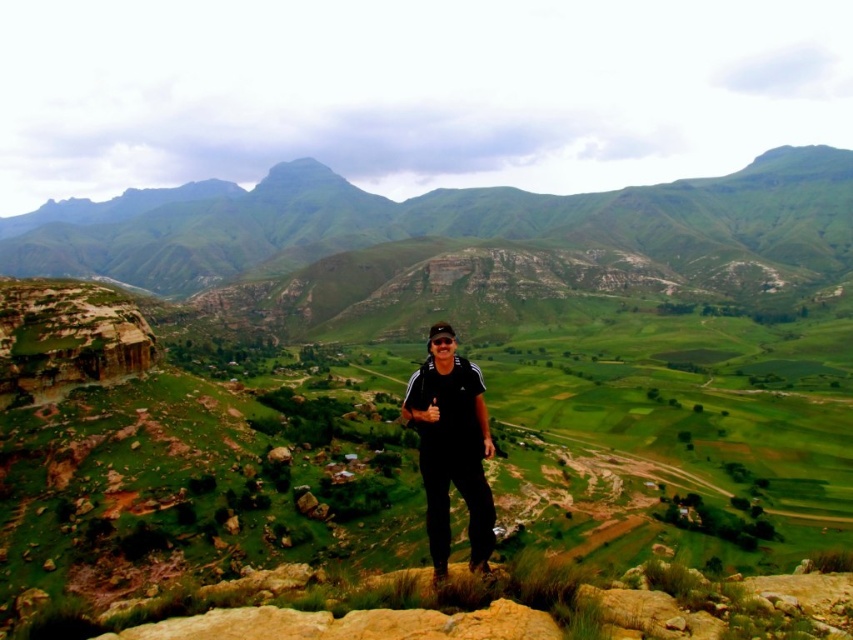
Question: Which of the following is the farthest from the observer?

Choices:
 (A) (427, 362)
 (B) (567, 273)

Answer: (B)

Question: Does green grassy mountain at center appear on the left side of black matte pants at center?

Choices:
 (A) no
 (B) yes

Answer: (B)

Question: Is green grassy mountain at center closer to camera compared to black matte pants at center?

Choices:
 (A) no
 (B) yes

Answer: (A)

Question: Can you confirm if green grassy mountain at center is bigger than black matte pants at center?

Choices:
 (A) no
 (B) yes

Answer: (B)

Question: Which point is farther to the camera?

Choices:
 (A) black matte pants at center
 (B) green grassy mountain at center

Answer: (B)

Question: Which of the following is the closest to the observer?

Choices:
 (A) (477, 388)
 (B) (172, 272)

Answer: (A)